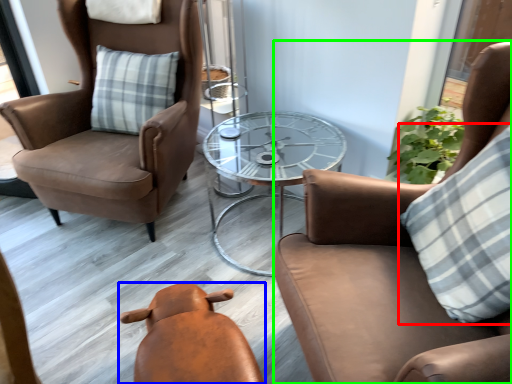
Question: Considering the real-world distances, which object is farthest from pillow (highlighted by a red box)? chair (highlighted by a blue box) or chair (highlighted by a green box)?

Choices:
 (A) chair
 (B) chair

Answer: (A)